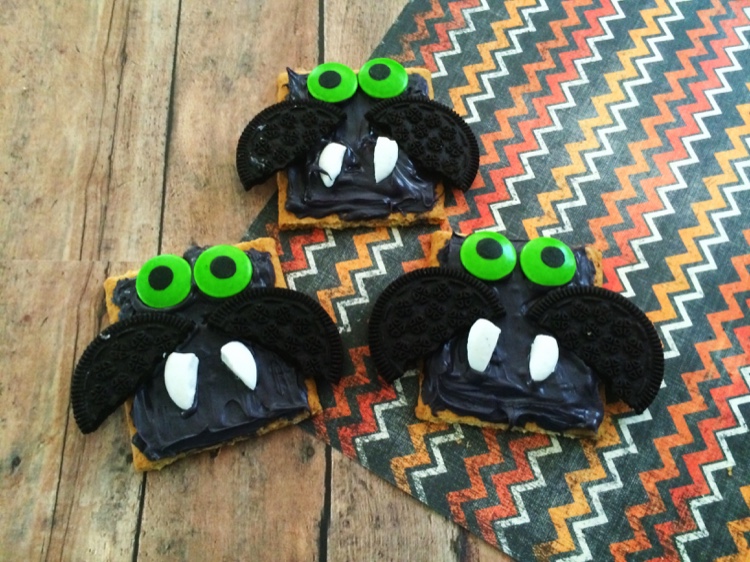
Find the location of `brown floor`. brown floor is located at coordinates tap(133, 67).